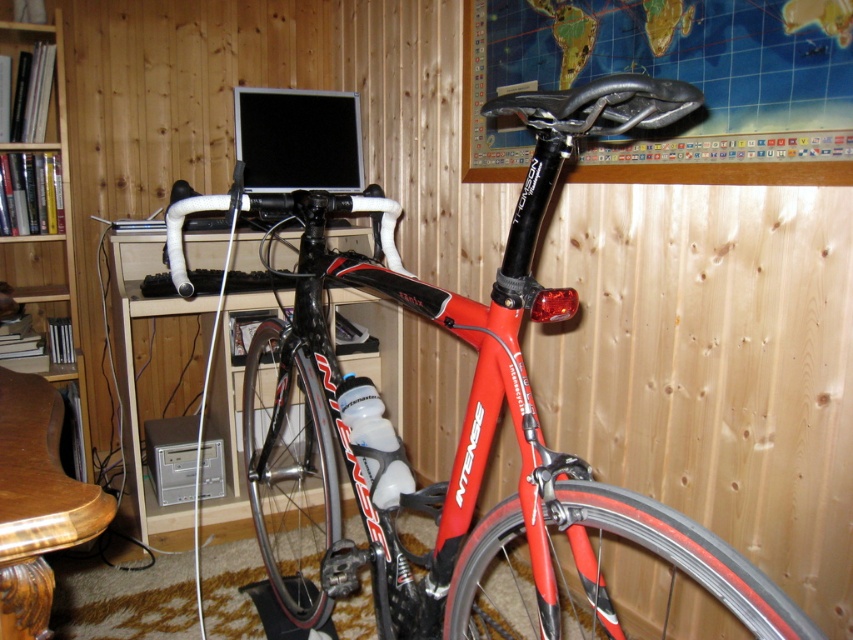
Question: Can you confirm if shiny red bicycle at center is positioned to the right of wooden polished table at lower left?

Choices:
 (A) no
 (B) yes

Answer: (B)

Question: Which is nearer to the wooden polished table at lower left?

Choices:
 (A) metallic silver desk at center
 (B) shiny red bicycle at center
 (C) wooden bookshelf at left

Answer: (B)

Question: Which of these objects is positioned closest to the shiny red bicycle at center?

Choices:
 (A) wooden polished table at lower left
 (B) wooden bookshelf at left

Answer: (A)

Question: Considering the relative positions of shiny red bicycle at center and wooden polished table at lower left in the image provided, where is shiny red bicycle at center located with respect to wooden polished table at lower left?

Choices:
 (A) right
 (B) left

Answer: (A)

Question: Does shiny red bicycle at center appear over wooden polished table at lower left?

Choices:
 (A) no
 (B) yes

Answer: (A)

Question: Which point is farther from the camera taking this photo?

Choices:
 (A) 297,518
 (B) 396,392
 (C) 70,234
 (D) 0,428

Answer: (B)